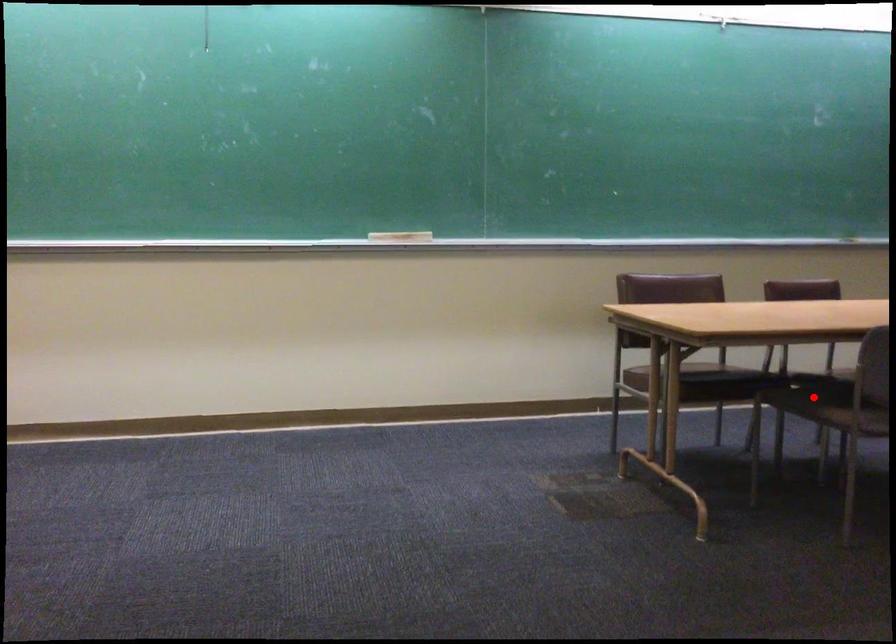
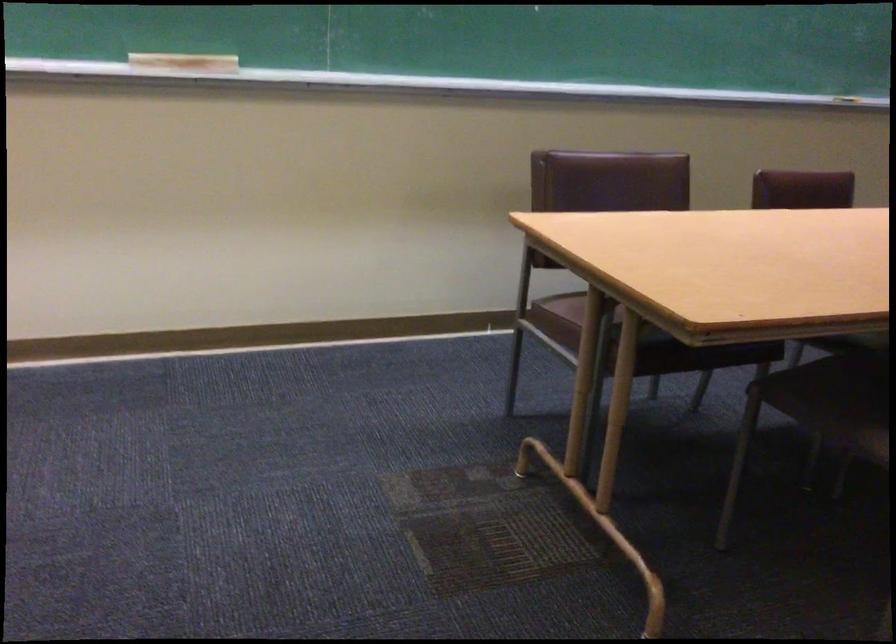
Question: I am providing you with two images of the same scene from different viewpoints. A red point is shown in image1. For the corresponding object point in image2, is it positioned nearer or farther from the camera?

Choices:
 (A) Nearer
 (B) Farther

Answer: (A)